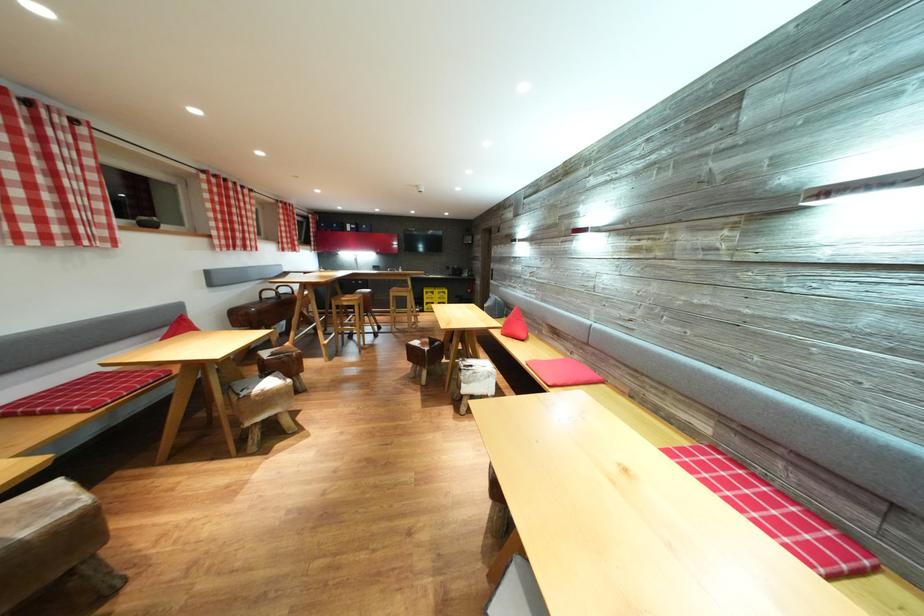
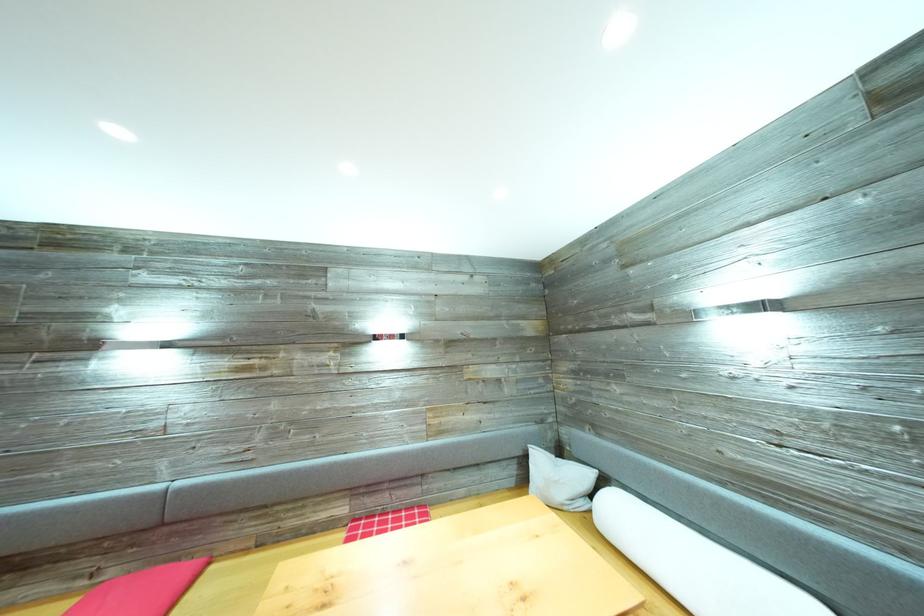
In the second image, find the point that corresponds to (x=581, y=362) in the first image.

(117, 578)